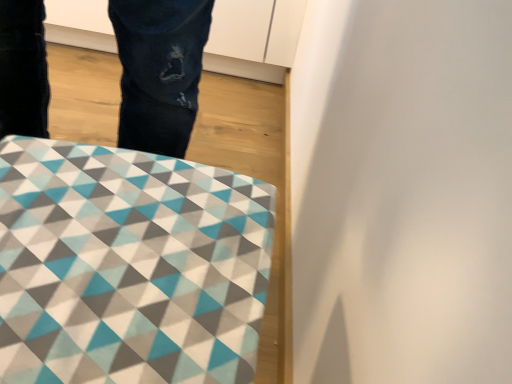
The height and width of the screenshot is (384, 512). Find the location of `geometric-patterned fabric at lower left`. geometric-patterned fabric at lower left is located at coordinates (128, 266).

What do you see at coordinates (128, 266) in the screenshot?
I see `geometric-patterned fabric at lower left` at bounding box center [128, 266].

Find the location of a particular element. This screenshot has height=384, width=512. geometric-patterned fabric at lower left is located at coordinates (128, 266).